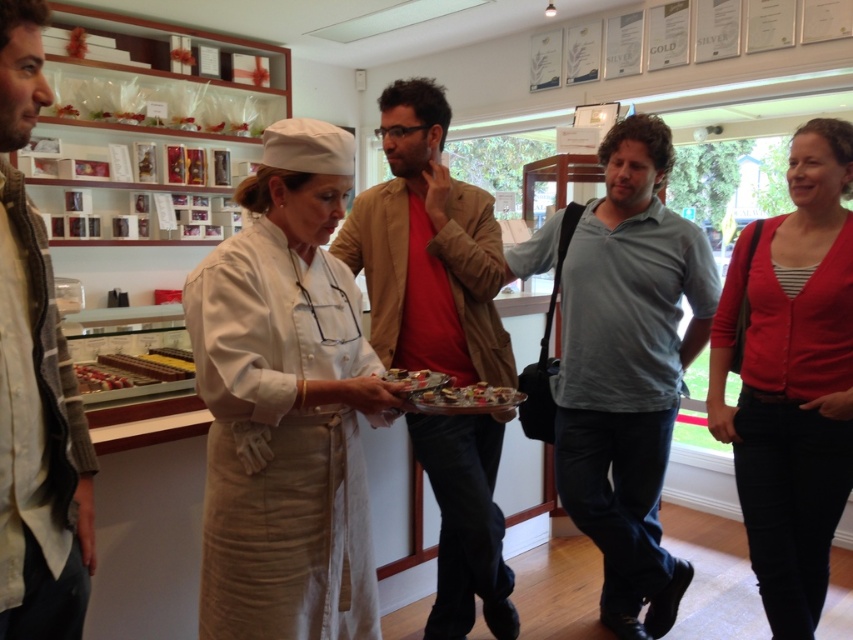
Question: Is matte beige blazer at center to the left of chocolate matte at center from the viewer's perspective?

Choices:
 (A) no
 (B) yes

Answer: (A)

Question: Can you confirm if white linen chef hat at center is bigger than light brown jacket at left?

Choices:
 (A) yes
 (B) no

Answer: (A)

Question: Which object appears farthest from the camera in this image?

Choices:
 (A) matte beige blazer at center
 (B) gray cotton polo shirt at center
 (C) light brown jacket at left
 (D) white linen chef hat at center

Answer: (B)

Question: Is gray cotton polo shirt at center closer to camera compared to matte beige blazer at center?

Choices:
 (A) yes
 (B) no

Answer: (B)

Question: Estimate the real-world distances between objects in this image. Which object is farther from the matte beige blazer at center?

Choices:
 (A) gray cotton polo shirt at center
 (B) white linen chef hat at center
 (C) red cardigan at right
 (D) shiny chocolate tray at center

Answer: (C)

Question: Which point is closer to the camera?

Choices:
 (A) red cardigan at right
 (B) matte beige blazer at center

Answer: (A)